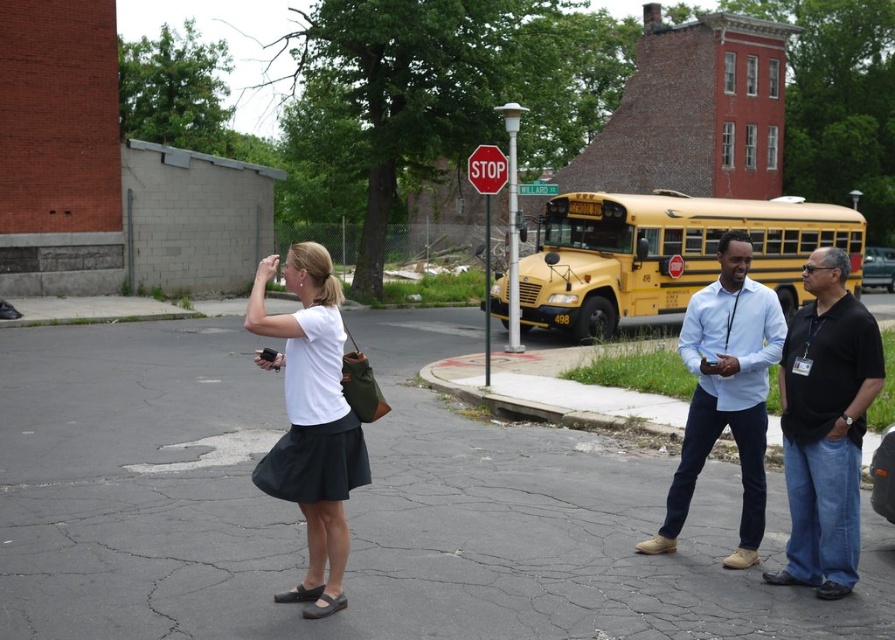
You are a pedestrian standing on the cracked asphalt surface in the foreground. You see the white matte shirt at center and the red plastic stop sign at upper center. Which object is taller?

The red plastic stop sign at upper center is taller than the white matte shirt at center.

You are standing at point (651, 307) and want to walk to the nearest building entrance. The nearest building entrance is 50 feet away from you. Is the entrance closer to you than the viewer?

The distance between point (651, 307) and the viewer is 65.20 feet. The nearest building entrance is 50 feet away from point (651, 307), so the entrance is closer to you than the viewer.

You are standing at the point labeled point (618, 266) and want to walk to point (305, 492). Is the path between these two points going towards the background or the foreground?

The path between point (618, 266) and point (305, 492) is going towards the background because point (618, 266) is closer to the viewer than point (305, 492).